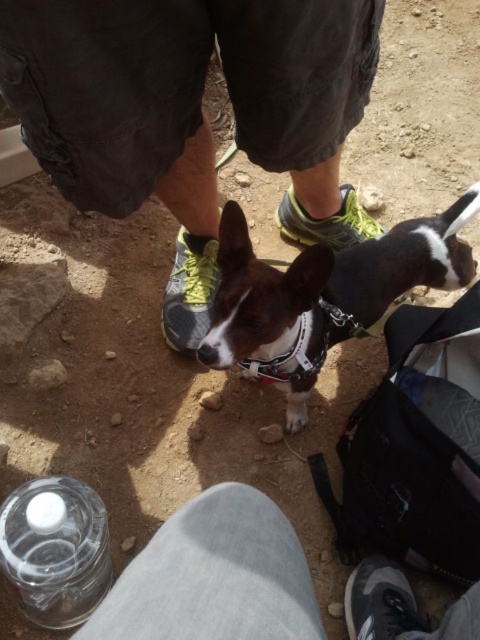
Is matte black shorts at center to the left of neon yellow mesh sneaker at center from the viewer's perspective?

Correct, you'll find matte black shorts at center to the left of neon yellow mesh sneaker at center.

Is matte black shorts at center below neon yellow mesh sneaker at center?

Yes.

Who is more forward, (x=296, y=188) or (x=343, y=193)?

Point (x=296, y=188) is in front.

This screenshot has width=480, height=640. I want to click on matte black shorts at center, so (x=192, y=113).

Is gray mesh shoe at center smaller than neon yellow mesh sneaker at center?

Indeed, gray mesh shoe at center has a smaller size compared to neon yellow mesh sneaker at center.

Which is in front, point (195, 241) or point (286, 212)?

Point (195, 241) is more forward.

The width and height of the screenshot is (480, 640). I want to click on gray mesh shoe at center, so click(x=190, y=291).

Does point (43, 612) come farther from viewer compared to point (340, 237)?

No, (43, 612) is closer to viewer.

Is point (56, 576) positioned after point (319, 240)?

That is False.

I want to click on clear plastic bottle at lower left, so click(56, 548).